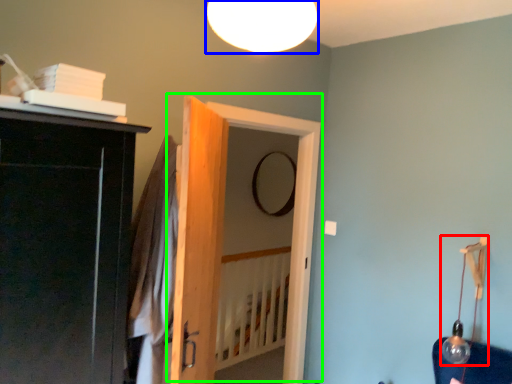
Question: Based on their relative distances, which object is nearer to lamp (highlighted by a red box)? Choose from lamp (highlighted by a blue box) and door (highlighted by a green box).

Choices:
 (A) lamp
 (B) door

Answer: (B)